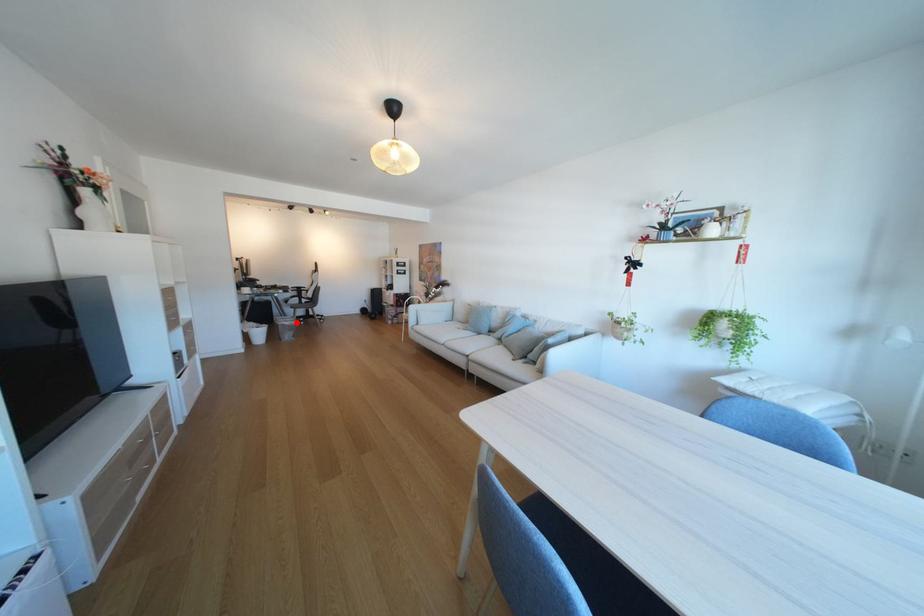
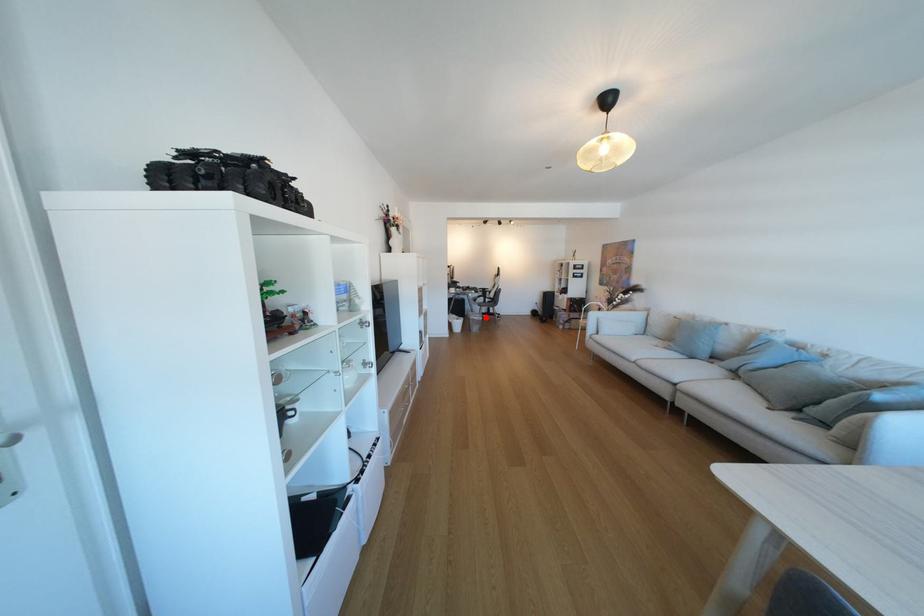
I am providing you with two images of the same scene from different viewpoints. A red point is marked on the first image and another point is marked on the second image. Is the marked point in image1 the same physical position as the marked point in image2?

Yes